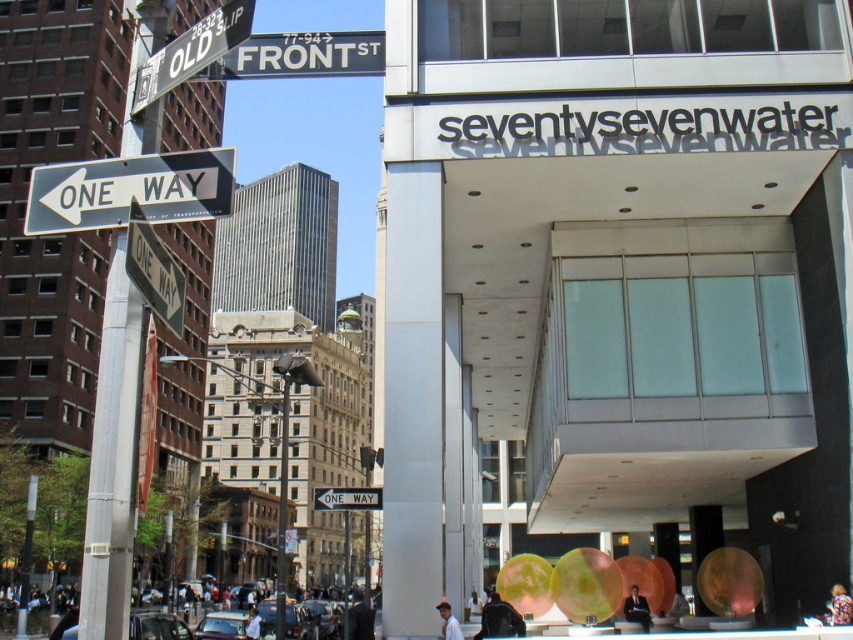
You are driving a car and see the black plastic one way sign at left and the white plastic street sign at upper center. Which one is closer to the ground?

The black plastic one way sign at left is positioned under the white plastic street sign at upper center, so the black plastic one way sign at left is closer to the ground.

You are a delivery driver approaching the intersection and see both the black plastic one way sign at left and the metallic silver street sign at upper left. Which sign is larger in size?

The black plastic one way sign at left is bigger than the metallic silver street sign at upper left, so the black plastic one way sign at left is larger in size.

You are a delivery driver approaching the intersection and need to read both the black plastic one way sign at left and the metallic silver street sign at upper left. Can you read both signs clearly from your current position 2 meters away?

The black plastic one way sign at left and metallic silver street sign at upper left are 1.46 meters apart from each other. Since you are 2 meters away, you can read both signs clearly as the distance between them is less than your viewing distance.